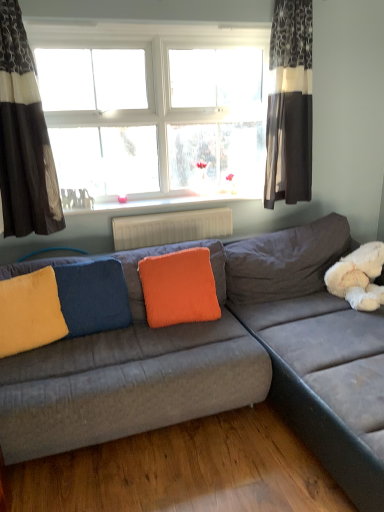
The width and height of the screenshot is (384, 512). Identify the location of free point above white glass window at upper center (from a real-world perspective). (158, 23).